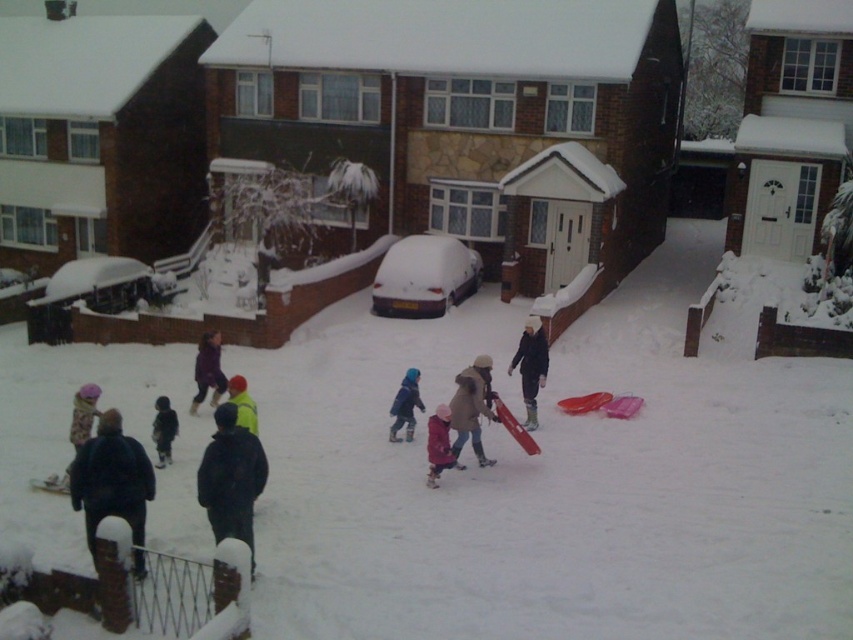
The image size is (853, 640). Describe the element at coordinates (207, 371) in the screenshot. I see `matte purple snowsuit at center` at that location.

Identify the location of matte purple snowsuit at center. (207, 371).

Where is `matte purple snowsuit at center`? This screenshot has height=640, width=853. matte purple snowsuit at center is located at coordinates (207, 371).

Is matte purple snowsuit at center wider than matte pink snowsuit at center?

Yes, matte purple snowsuit at center is wider than matte pink snowsuit at center.

Is matte purple snowsuit at center below matte pink snowsuit at center?

Actually, matte purple snowsuit at center is above matte pink snowsuit at center.

Image resolution: width=853 pixels, height=640 pixels. Find the location of `matte purple snowsuit at center`. matte purple snowsuit at center is located at coordinates (207, 371).

The width and height of the screenshot is (853, 640). What are the coordinates of `matte purple snowsuit at center` in the screenshot? It's located at (207, 371).

Between black matte jacket at lower left and shiny yellow jacket at center, which one is positioned higher?

Positioned higher is shiny yellow jacket at center.

Who is more distant from viewer, (107, 440) or (250, 420)?

The point (250, 420) is more distant.

Is point (74, 472) positioned behind point (253, 408)?

No.

Image resolution: width=853 pixels, height=640 pixels. I want to click on black matte jacket at lower left, so click(x=111, y=480).